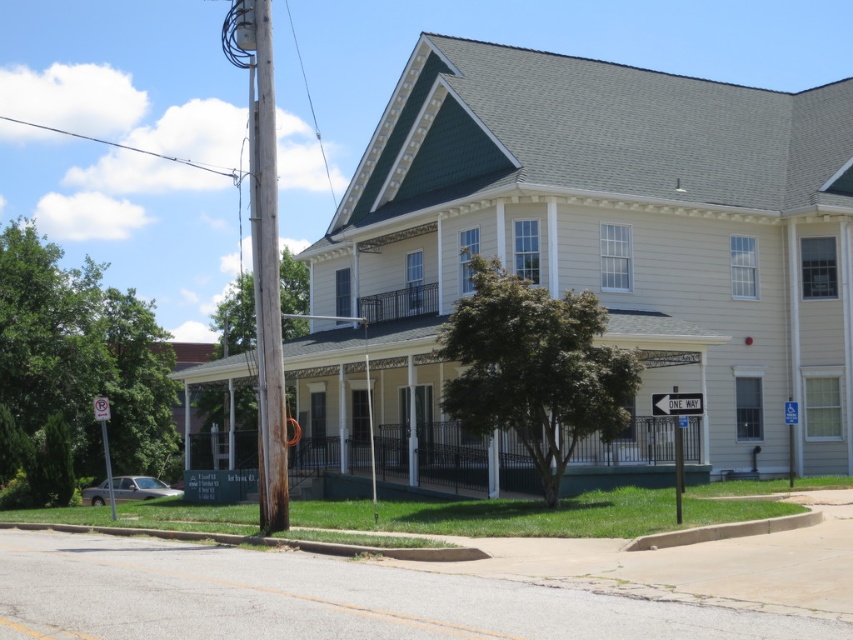
Question: Which point is farther to the camera?

Choices:
 (A) (556, 108)
 (B) (283, 440)
 (C) (579, 467)

Answer: (A)

Question: Is green painted wood porch at center below brown wooden pole at left?

Choices:
 (A) no
 (B) yes

Answer: (B)

Question: Is yellow siding at center below green painted wood porch at center?

Choices:
 (A) no
 (B) yes

Answer: (A)

Question: Among these objects, which one is nearest to the camera?

Choices:
 (A) green painted wood porch at center
 (B) brown wooden pole at left
 (C) yellow siding at center

Answer: (B)

Question: Considering the real-world distances, which object is farthest from the brown wooden pole at left?

Choices:
 (A) yellow siding at center
 (B) green painted wood porch at center

Answer: (A)

Question: Does yellow siding at center appear under brown wooden pole at left?

Choices:
 (A) yes
 (B) no

Answer: (B)